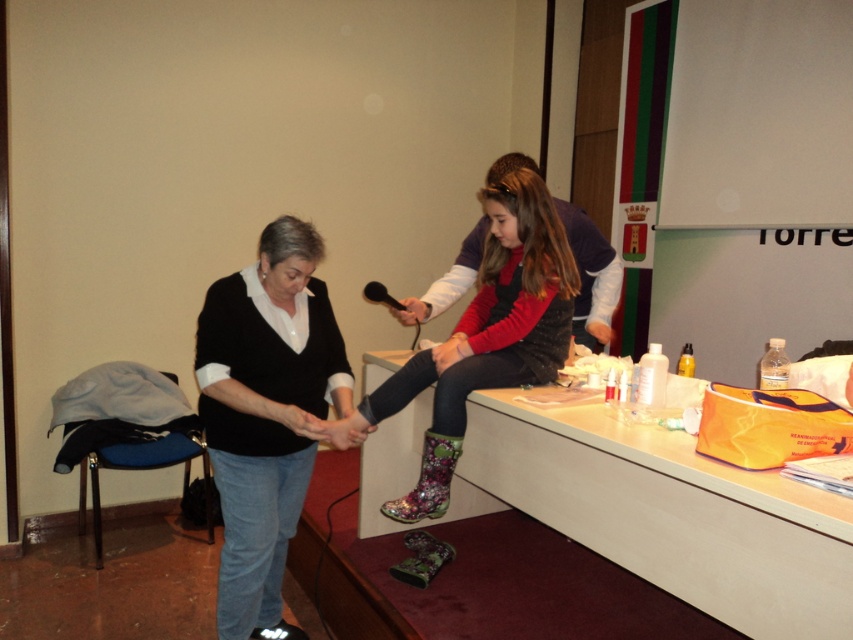
Question: Is matte black hand at lower center closer to the viewer compared to matte black hand at center?

Choices:
 (A) no
 (B) yes

Answer: (B)

Question: Among these objects, which one is nearest to the camera?

Choices:
 (A) black matte sweater at center
 (B) matte black hand at center

Answer: (A)

Question: Is matte black hand at lower center thinner than matte black hand at center?

Choices:
 (A) yes
 (B) no

Answer: (B)

Question: Among these objects, which one is nearest to the camera?

Choices:
 (A) floral rubber boots at center
 (B) black matte sweater at center

Answer: (B)

Question: Which of the following is the farthest from the observer?

Choices:
 (A) matte black hand at center
 (B) black matte sweater at center

Answer: (A)

Question: Is black matte sweater at center to the left of matte black hand at lower center from the viewer's perspective?

Choices:
 (A) no
 (B) yes

Answer: (B)